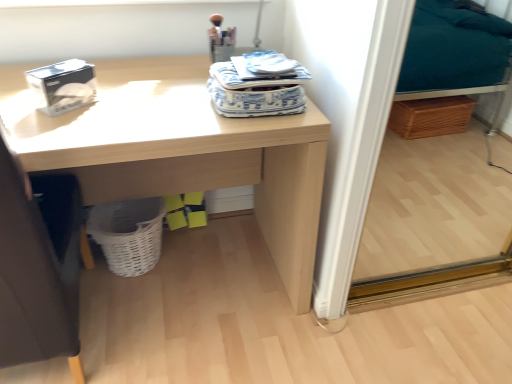
Image resolution: width=512 pixels, height=384 pixels. Identify the location of empty space that is to the right of yellow matte box at lower center, the first box in the bottom-to-top sequence. (224, 226).